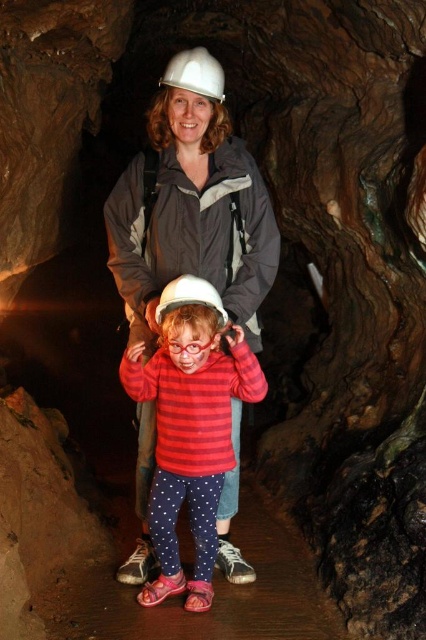
Question: Can you confirm if striped cotton shirt at center is thinner than white matte helmet at center?

Choices:
 (A) yes
 (B) no

Answer: (B)

Question: Estimate the real-world distances between objects in this image. Which object is farther from the white matte helmet at upper center?

Choices:
 (A) white matte helmet at center
 (B) matte white helmet at center

Answer: (A)

Question: Considering the relative positions of matte white helmet at center and striped cotton shirt at center in the image provided, where is matte white helmet at center located with respect to striped cotton shirt at center?

Choices:
 (A) right
 (B) left

Answer: (B)

Question: Which point is farther to the camera?

Choices:
 (A) striped cotton shirt at center
 (B) white matte helmet at center
 (C) white matte helmet at upper center
 (D) matte white helmet at center

Answer: (D)

Question: Is matte white helmet at center to the left of white matte helmet at center from the viewer's perspective?

Choices:
 (A) yes
 (B) no

Answer: (A)

Question: Estimate the real-world distances between objects in this image. Which object is closer to the striped cotton shirt at center?

Choices:
 (A) white matte helmet at upper center
 (B) white matte helmet at center
 (C) matte white helmet at center

Answer: (B)